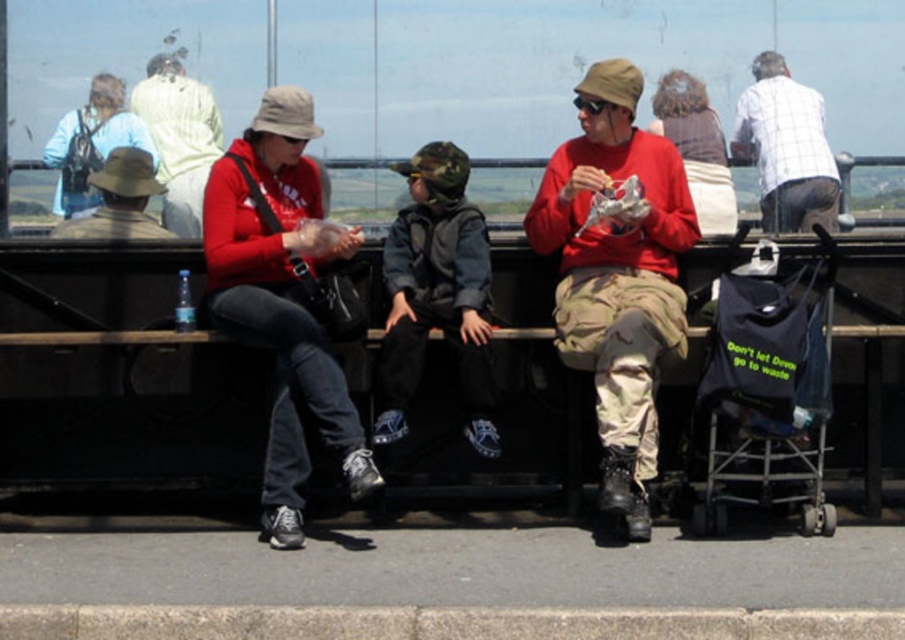
Question: Is matte khaki hat at center above brown fabric hat at left?

Choices:
 (A) no
 (B) yes

Answer: (A)

Question: Which point appears closest to the camera in this image?

Choices:
 (A) (148, 225)
 (B) (599, 401)

Answer: (B)

Question: Where is matte red hoodie at center located in relation to camo fabric jacket at center in the image?

Choices:
 (A) above
 (B) below

Answer: (B)

Question: Considering the real-world distances, which object is farthest from the camo fabric jacket at center?

Choices:
 (A) matte red hoodie at center
 (B) dark blue fabric stroller at right
 (C) white checkered shirt at upper right

Answer: (C)

Question: From the image, what is the correct spatial relationship of matte red hoodie at center in relation to dark blue fabric stroller at right?

Choices:
 (A) left
 (B) right

Answer: (A)

Question: Estimate the real-world distances between objects in this image. Which object is closer to the camo fabric jacket at center?

Choices:
 (A) dark blue fabric stroller at right
 (B) brown fabric hat at left

Answer: (A)